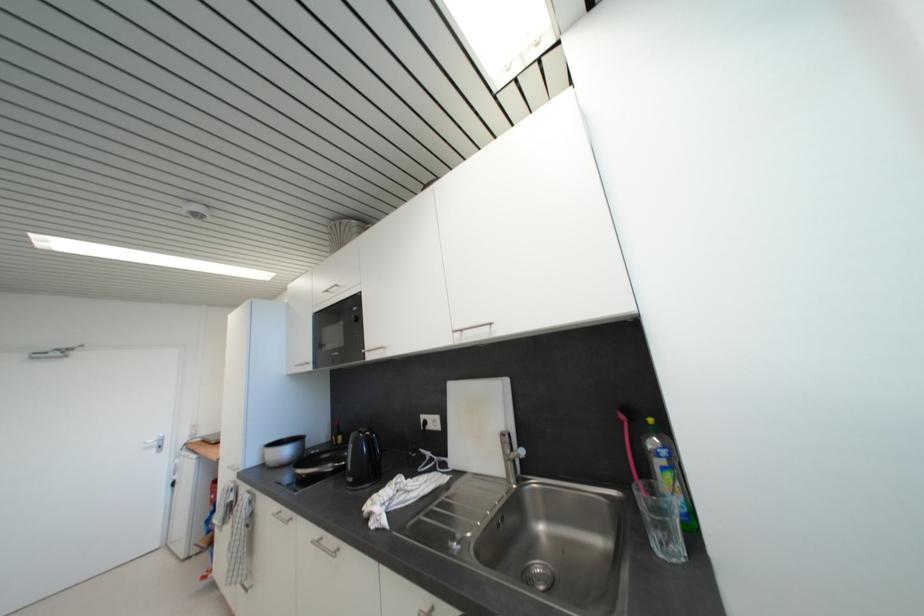
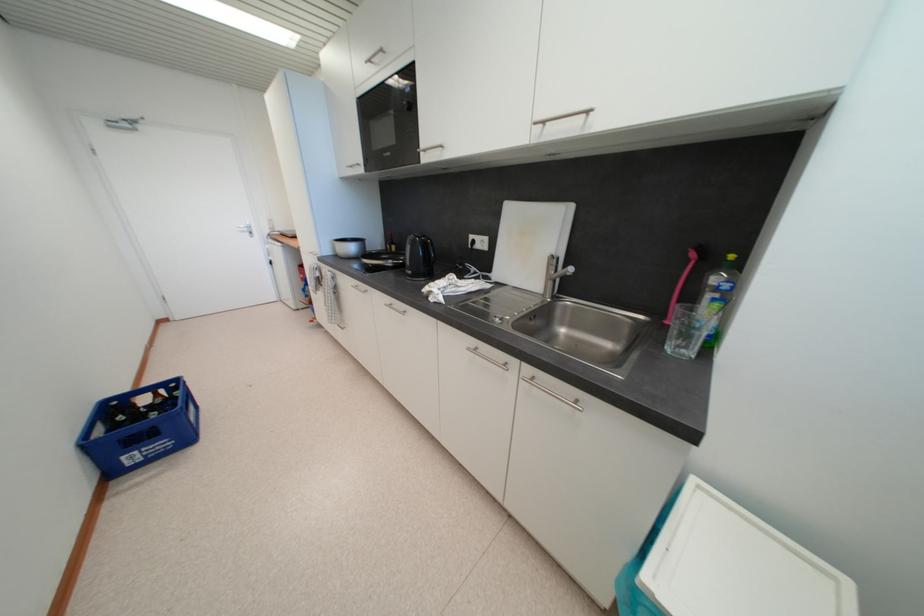
Question: I am providing you with two images of the same scene from different viewpoints. After the viewpoint changes to image2, which objects are now occluded?

Choices:
 (A) black electric kettle
 (B) frying pan handle
 (C) clear drinking glass
 (D) none of these

Answer: (D)